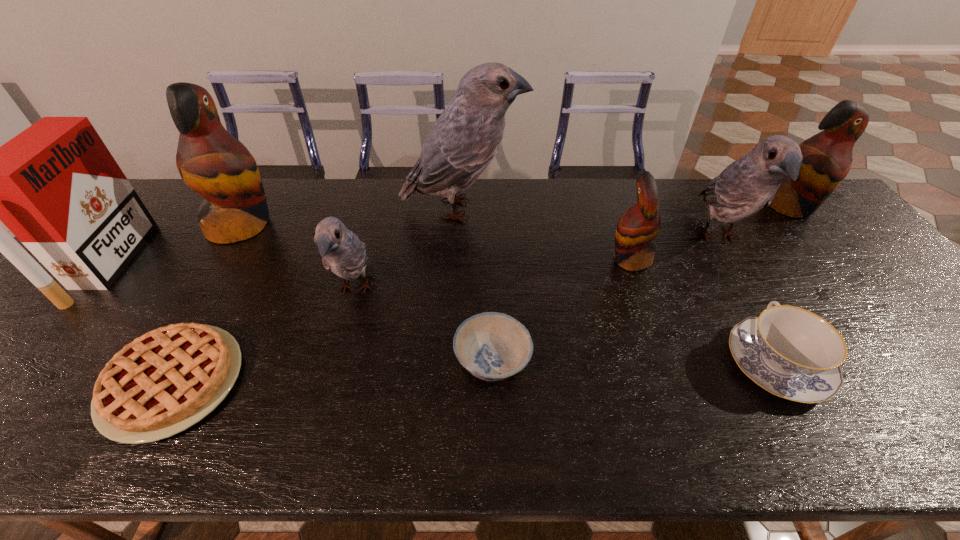
This screenshot has height=540, width=960. In order to click on empty space between the leftmost red parrot and the leftmost object in this screenshot , I will do `click(176, 245)`.

Locate an element on the screen. unoccupied position between the second red parrot from left to right and the biggest red parrot is located at coordinates (436, 242).

Identify which object is the closest to the biggest red parrot. Please provide its 2D coordinates. Your answer should be formatted as a tuple, i.e. [(x, y)], where the tuple contains the x and y coordinates of a point satisfying the conditions above.

[(55, 186)]

Identify the location of object that stands as the closest to the second gray parrot from left to right. (342, 252).

Select which parrot is the fourth closest to the cigarette case. Please provide its 2D coordinates. Your answer should be formatted as a tuple, i.e. [(x, y)], where the tuple contains the x and y coordinates of a point satisfying the conditions above.

[(638, 226)]

Select which parrot is the closest to the third shortest object. Please provide its 2D coordinates. Your answer should be formatted as a tuple, i.e. [(x, y)], where the tuple contains the x and y coordinates of a point satisfying the conditions above.

[(748, 184)]

This screenshot has width=960, height=540. In order to click on the second closest gray parrot relative to the tan pie in this screenshot , I will do `click(462, 142)`.

This screenshot has width=960, height=540. Find the location of `gray parrot that can be found as the third closest to the third shortest object`. gray parrot that can be found as the third closest to the third shortest object is located at coordinates (342, 252).

This screenshot has height=540, width=960. I want to click on red parrot object that ranks as the closest to the tan pie, so click(x=212, y=162).

Locate which red parrot ranks third in proximity to the blue bowl. Please provide its 2D coordinates. Your answer should be formatted as a tuple, i.e. [(x, y)], where the tuple contains the x and y coordinates of a point satisfying the conditions above.

[(827, 156)]